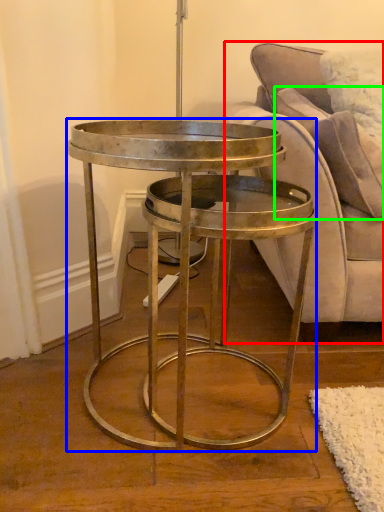
Question: Which object is the farthest from studio couch (highlighted by a red box)? Choose among these: coffee table (highlighted by a blue box) or pillow (highlighted by a green box).

Choices:
 (A) coffee table
 (B) pillow

Answer: (A)